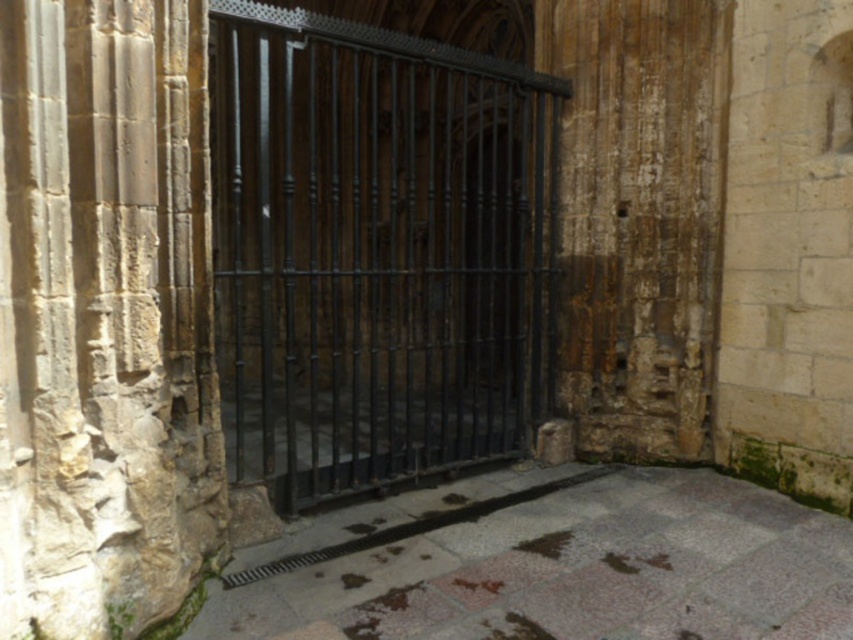
Looking at this image, you are standing in front of the old stone structure and want to reach the point marked as point (223, 416). Can you estimate how far you need to walk to get there?

The point (223, 416) is 8.09 meters away from the camera, so you need to walk approximately 8.09 meters to reach it.

You are a maintenance worker tasked with repairing the black wrought iron gate at center and the stone textured pillar at center. Which object is closer to you when you stand in front of the gate?

The black wrought iron gate at center is closer to you because the stone textured pillar at center is behind it.

You are a painter who needs to fit a 1.2 meter wide canvas between the black wrought iron gate at center and the stone textured pillar at center. Can you determine if the space between them is wide enough for your canvas?

The black wrought iron gate at center is thinner than the stone textured pillar at center, so the space between them may vary depending on their positions. However, since the gate is thinner, it might allow enough space for the 1.2 meter wide canvas. But without exact measurements, it is uncertain. Consider measuring the gap before placing the canvas.